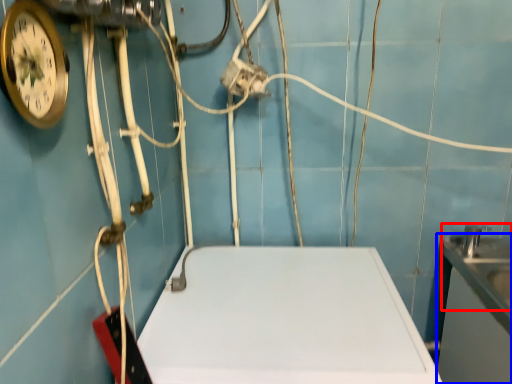
Question: Among these objects, which one is nearest to the camera, sink (highlighted by a red box) or counter top (highlighted by a blue box)?

Choices:
 (A) sink
 (B) counter top

Answer: (B)